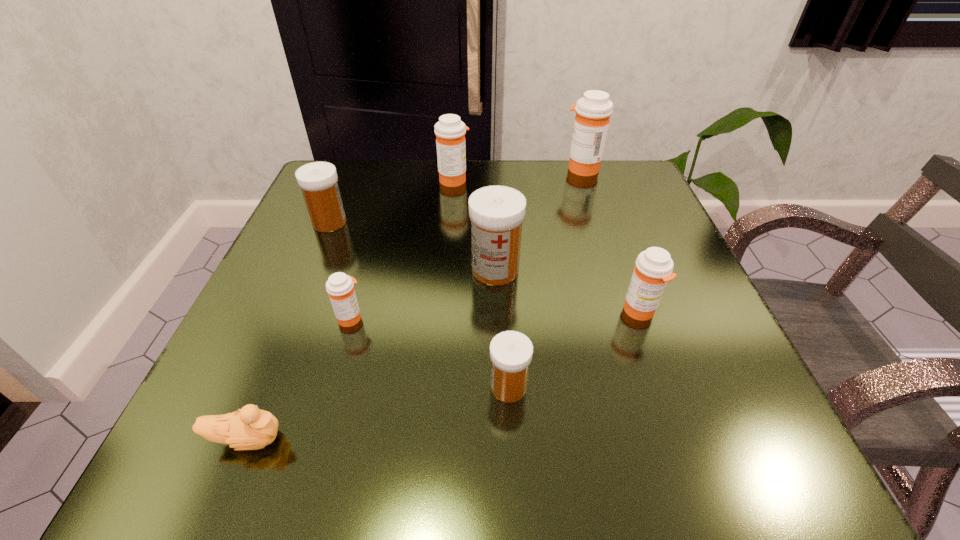
Identify the location of free spot located on the front of the leftmost orange medicine. [309, 464].

Find the location of a particular element. This screenshot has width=960, height=540. vacant region located on the front of the second nearest object is located at coordinates (512, 446).

This screenshot has width=960, height=540. I want to click on free space located on the face of the nearest object, so click(595, 439).

Identify the location of object at the near edge. This screenshot has width=960, height=540. (251, 428).

Locate an element on the screen. duckling that is at the left edge is located at coordinates (251, 428).

At what (x,y) coordinates should I click in order to perform the action: click on object that is at the far left corner. Please return your answer as a coordinate pair (x, y). Looking at the image, I should click on (318, 180).

Where is `object that is at the near left corner`? The height and width of the screenshot is (540, 960). object that is at the near left corner is located at coordinates (251, 428).

Locate an element on the screen. The height and width of the screenshot is (540, 960). object present at the far right corner is located at coordinates (593, 111).

In the image, there is a desktop. At what (x,y) coordinates should I click in order to perform the action: click on vacant space at the far edge. Please return your answer as a coordinate pair (x, y). Looking at the image, I should click on (571, 205).

In the image, there is a desktop. Where is `vacant space at the near edge`? This screenshot has height=540, width=960. vacant space at the near edge is located at coordinates (438, 446).